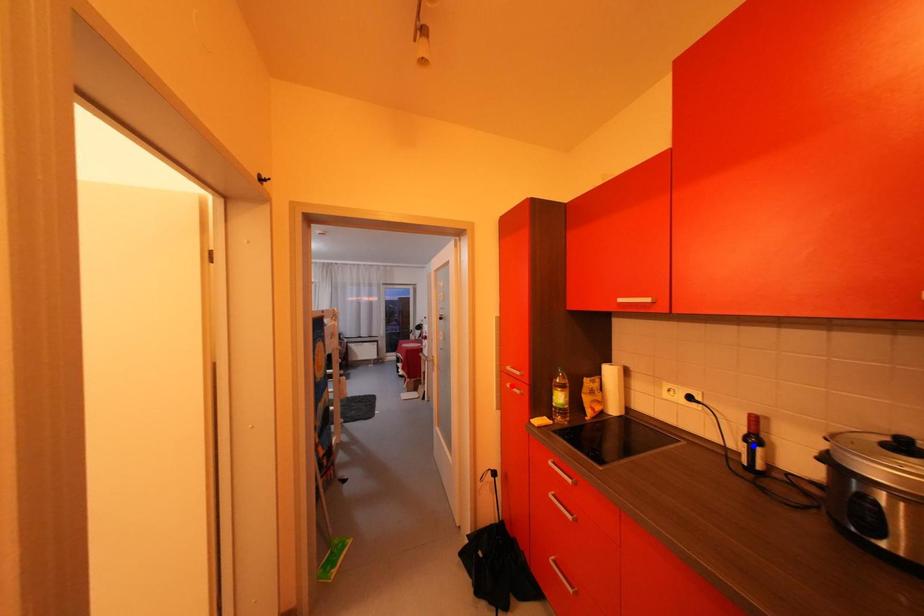
Question: Which of the two points in the image is closer to the camera?

Choices:
 (A) Blue point is closer.
 (B) Red point is closer.

Answer: (A)